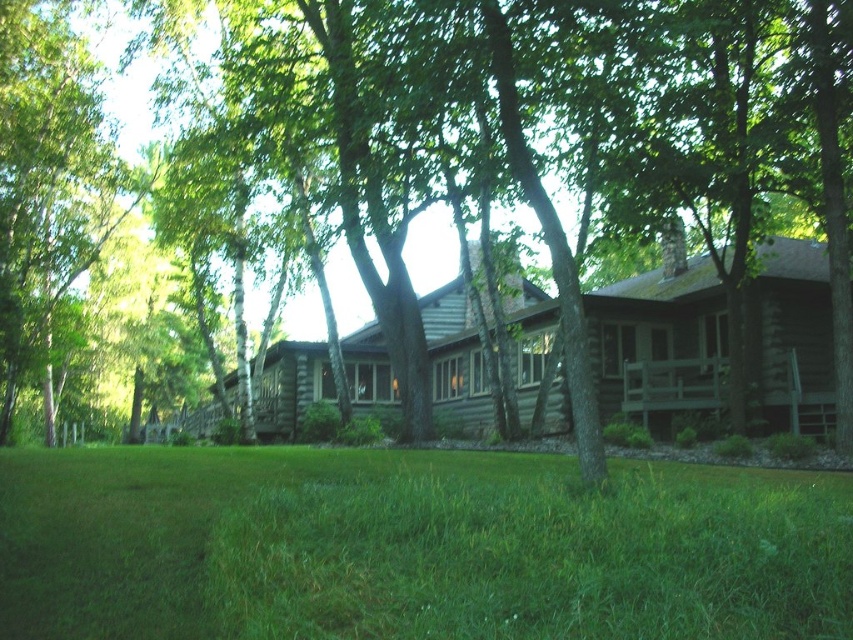
Who is positioned more to the right, green grass at lower center or brown/log cabin at center?

brown/log cabin at center is more to the right.

Does point (395, 616) come farther from viewer compared to point (556, 308)?

No, (395, 616) is closer to viewer.

Where is `green grass at lower center`? This screenshot has width=853, height=640. green grass at lower center is located at coordinates (413, 547).